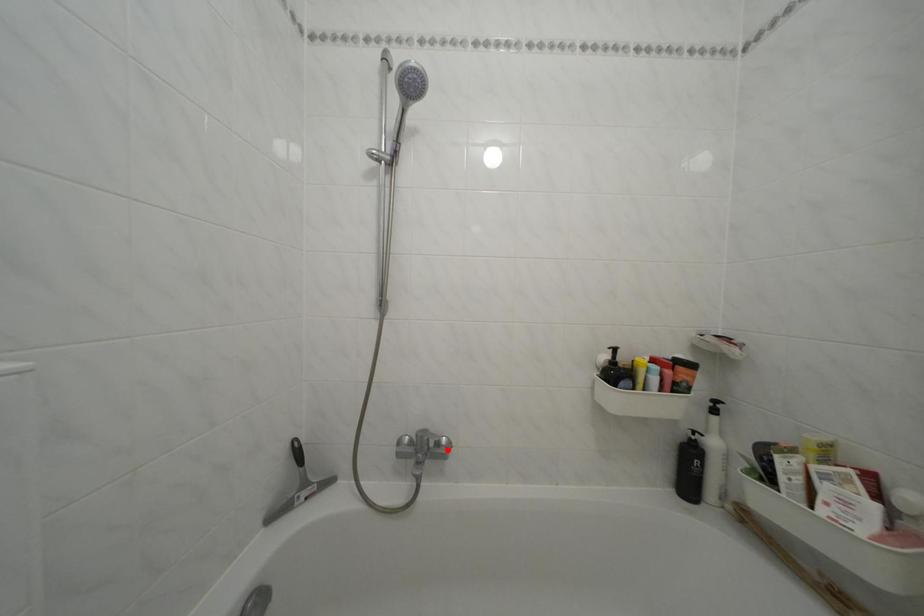
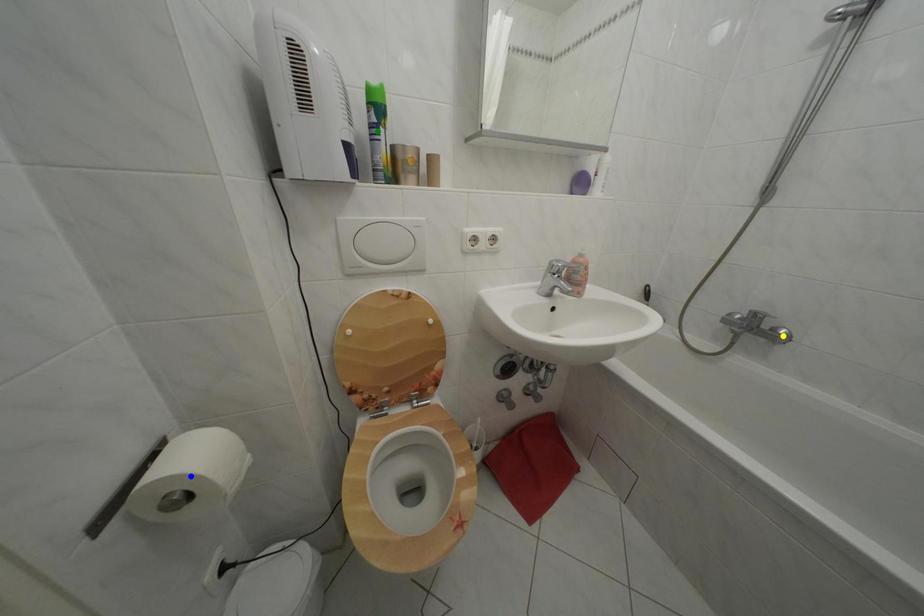
Question: I am providing you with two images of the same scene from different viewpoints. A red point is marked on the first image. You are given multiple points on the second image. Which mark in image 2 goes with the point in image 1?

Choices:
 (A) yellow point
 (B) green point
 (C) blue point

Answer: (A)